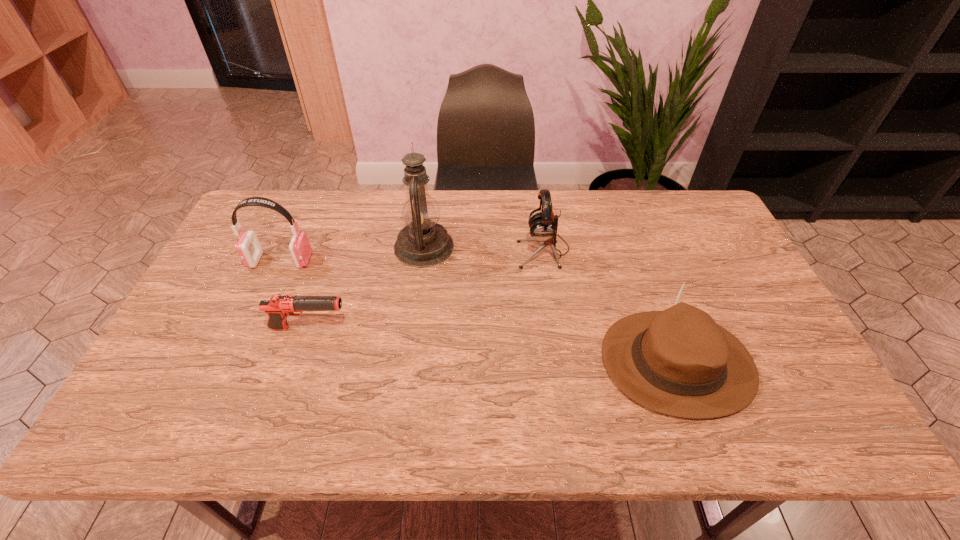
What are the coordinates of `vacant space located 0.380m on the feather side of the fourth tallest object` in the screenshot? It's located at (448, 363).

At what (x,y) coordinates should I click in order to perform the action: click on free region located on the feather side of the fourth tallest object. Please return your answer as a coordinate pair (x, y). The width and height of the screenshot is (960, 540). Looking at the image, I should click on tap(452, 363).

What are the coordinates of `blank space located on the feather side of the fourth tallest object` in the screenshot? It's located at (440, 363).

Identify the location of blank space located at the aiming end of the gun. (409, 328).

Identify the location of oil lamp that is positioned at the far edge. The width and height of the screenshot is (960, 540). (423, 242).

Identify the location of earphone that is positioned at the far edge. The height and width of the screenshot is (540, 960). (543, 225).

Locate an element on the screen. object located in the near edge section of the desktop is located at coordinates (679, 362).

Where is `object that is at the left edge`? object that is at the left edge is located at coordinates (248, 247).

Identify the location of object that is positioned at the right edge. This screenshot has width=960, height=540. (679, 362).

What are the coordinates of `object that is positioned at the near right corner` in the screenshot? It's located at (679, 362).